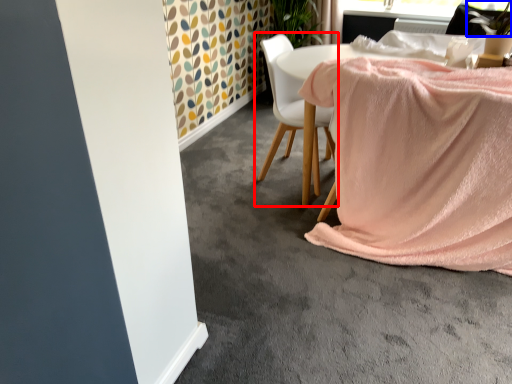
Question: Which object is further to the camera taking this photo, chair (highlighted by a red box) or plant (highlighted by a blue box)?

Choices:
 (A) chair
 (B) plant

Answer: (A)